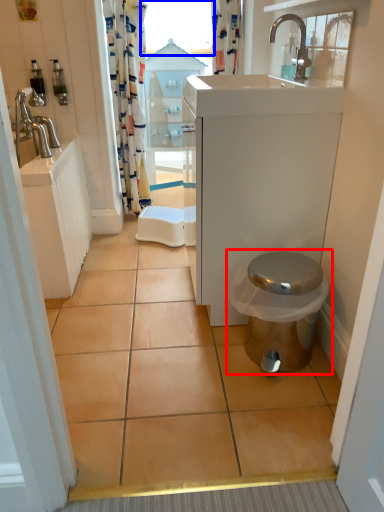
Question: Among these objects, which one is nearest to the camera, toilet (highlighted by a red box) or window screen (highlighted by a blue box)?

Choices:
 (A) toilet
 (B) window screen

Answer: (A)